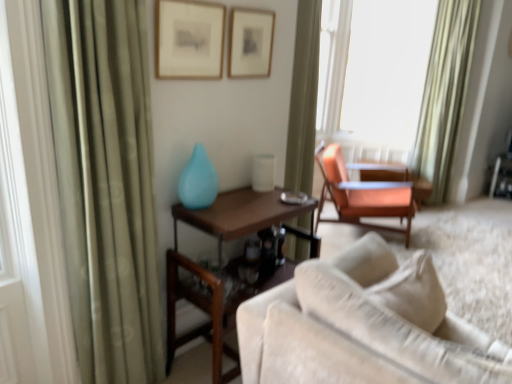
Where is `free space in front of white glossy table lamp at center`? free space in front of white glossy table lamp at center is located at coordinates (259, 197).